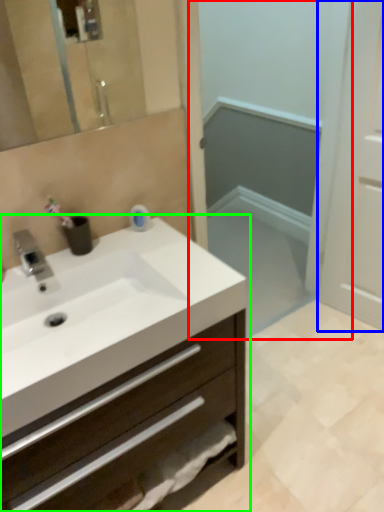
Question: Which is farther away from screen door (highlighted by a red box)? screen door (highlighted by a blue box) or bathroom cabinet (highlighted by a green box)?

Choices:
 (A) screen door
 (B) bathroom cabinet

Answer: (B)